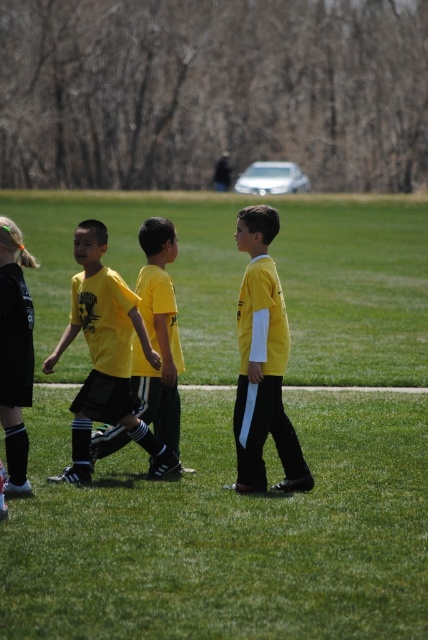
Question: Among these objects, which one is nearest to the camera?

Choices:
 (A) black matte shorts at lower left
 (B) yellow matte shirt at center
 (C) green grass at center

Answer: (C)

Question: Observing the image, what is the correct spatial positioning of green grass at center in reference to matte yellow shirt at center?

Choices:
 (A) below
 (B) above

Answer: (B)

Question: Does green grass at center appear on the right side of yellow matte shirt at center?

Choices:
 (A) no
 (B) yes

Answer: (A)

Question: Which point appears farthest from the camera in this image?

Choices:
 (A) (92, 403)
 (B) (68, 496)

Answer: (A)

Question: Is green grass at center thinner than matte yellow shirt at center?

Choices:
 (A) no
 (B) yes

Answer: (A)

Question: Which point is farther to the camera?

Choices:
 (A) yellow matte shirt at center
 (B) matte yellow shirt at center
 (C) green grass at center
 (D) black matte shorts at lower left

Answer: (B)